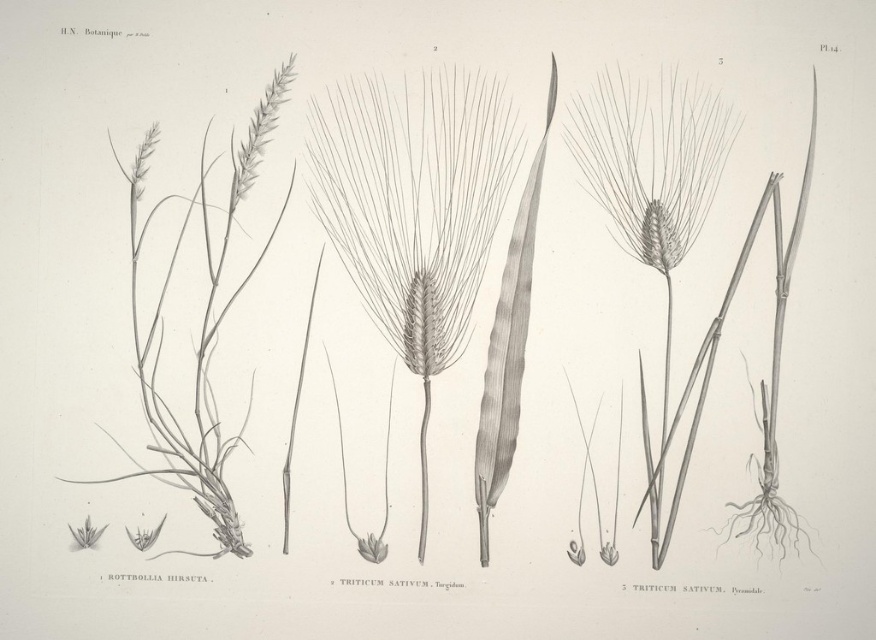
Is gray textured wheat ear at center to the right of smooth gray wheat ear at center from the viewer's perspective?

In fact, gray textured wheat ear at center is to the left of smooth gray wheat ear at center.

Does gray textured wheat ear at center have a lesser height compared to smooth gray wheat ear at center?

In fact, gray textured wheat ear at center may be taller than smooth gray wheat ear at center.

The image size is (876, 640). I want to click on gray textured wheat ear at center, so click(414, 200).

At what (x,y) coordinates should I click in order to perform the action: click on gray textured wheat ear at center. Please return your answer as a coordinate pair (x, y). Image resolution: width=876 pixels, height=640 pixels. Looking at the image, I should click on (414, 200).